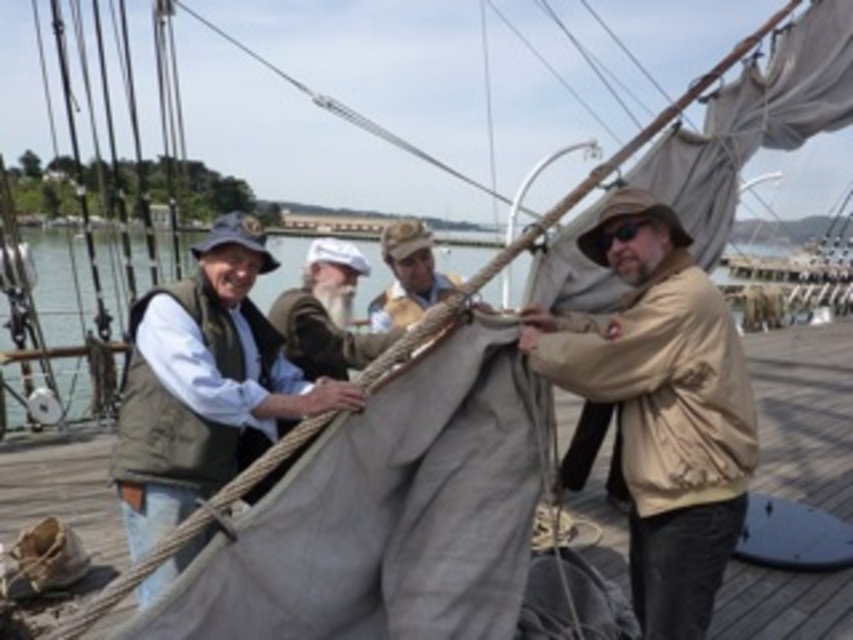
Question: Does green canvas vest at left appear under matte gray sail at center?

Choices:
 (A) no
 (B) yes

Answer: (B)

Question: Which object is positioned closest to the green canvas vest at left?

Choices:
 (A) khaki fabric hat at center
 (B) tan matte jacket at center

Answer: (B)

Question: Among these objects, which one is nearest to the camera?

Choices:
 (A) khaki fabric hat at center
 (B) green canvas vest at left
 (C) tan matte jacket at center

Answer: (B)

Question: Which object is farther from the camera taking this photo?

Choices:
 (A) green canvas vest at left
 (B) matte gray sail at center
 (C) khaki fabric hat at center

Answer: (C)

Question: Is green canvas vest at left closer to camera compared to matte gray sail at center?

Choices:
 (A) no
 (B) yes

Answer: (B)

Question: Can you confirm if green canvas vest at left is bigger than khaki fabric hat at center?

Choices:
 (A) no
 (B) yes

Answer: (B)